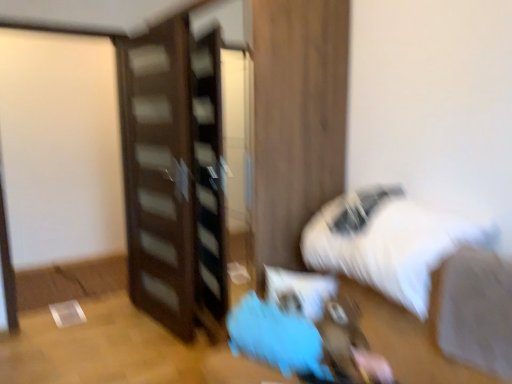
Question: Based on their positions, is dark wood dresser at center located to the left or right of blue fabric bean bag at lower center?

Choices:
 (A) right
 (B) left

Answer: (B)

Question: From the image's perspective, is dark wood dresser at center above or below blue fabric bean bag at lower center?

Choices:
 (A) below
 (B) above

Answer: (B)

Question: Which object is positioned farthest from the dark wood dresser at center?

Choices:
 (A) white fluffy bed at lower right
 (B) white fabric at lower right
 (C) blue fabric bean bag at lower center

Answer: (B)

Question: Which object is the farthest from the dark wood dresser at center?

Choices:
 (A) white fluffy bed at lower right
 (B) white fabric at lower right
 (C) blue fabric bean bag at lower center

Answer: (B)